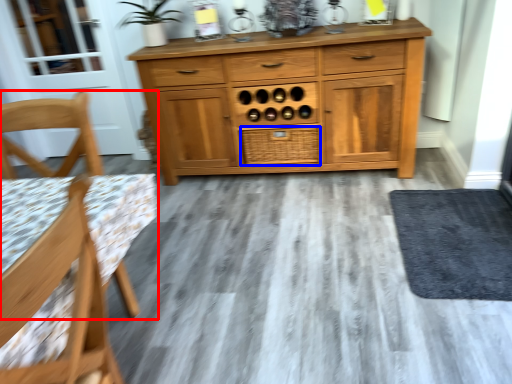
Question: Which object is further to the camera taking this photo, chair (highlighted by a red box) or drawer (highlighted by a blue box)?

Choices:
 (A) chair
 (B) drawer

Answer: (B)